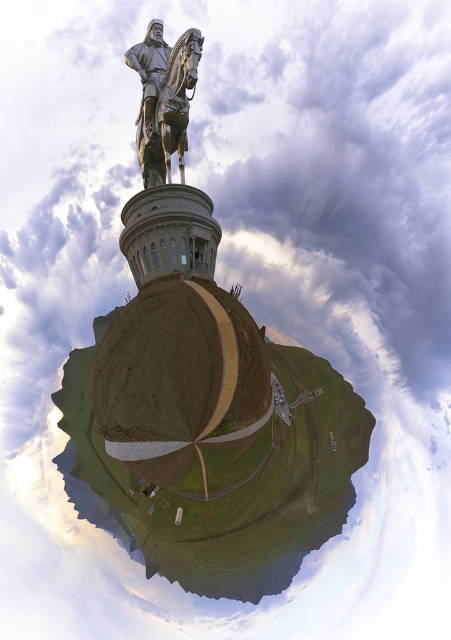
Question: Is brown grassy hill at center smaller than bronze statue at upper center?

Choices:
 (A) no
 (B) yes

Answer: (A)

Question: Can you confirm if bronze statue at upper center is positioned below polished bronze statue at upper center?

Choices:
 (A) yes
 (B) no

Answer: (A)

Question: Which object is the farthest from the polished bronze statue at upper center?

Choices:
 (A) brown grassy hill at center
 (B) bronze statue at upper center

Answer: (A)

Question: Among these objects, which one is nearest to the camera?

Choices:
 (A) bronze statue at upper center
 (B) brown grassy hill at center

Answer: (B)

Question: Which of these objects is positioned farthest from the bronze statue at upper center?

Choices:
 (A) brown grassy hill at center
 (B) polished bronze statue at upper center

Answer: (A)

Question: Is the position of brown grassy hill at center more distant than that of bronze statue at upper center?

Choices:
 (A) no
 (B) yes

Answer: (A)